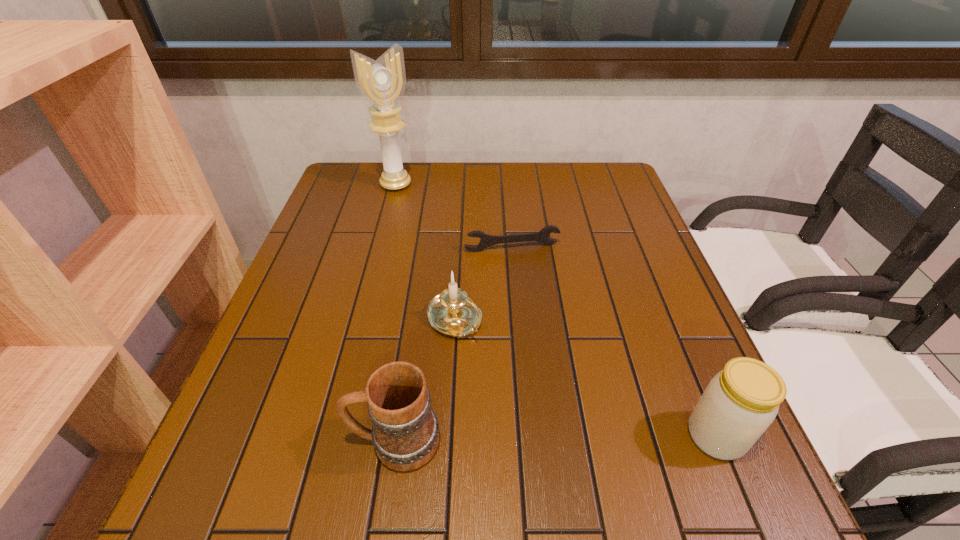
Locate an element on the screen. The height and width of the screenshot is (540, 960). free space located on the handle side of the third nearest object is located at coordinates (491, 368).

Locate an element on the screen. The width and height of the screenshot is (960, 540). object present at the far edge is located at coordinates (382, 82).

Where is `mug located at the near edge`? This screenshot has height=540, width=960. mug located at the near edge is located at coordinates (405, 434).

At what (x,y) coordinates should I click in order to perform the action: click on jar present at the near edge. Please return your answer as a coordinate pair (x, y). Image resolution: width=960 pixels, height=540 pixels. Looking at the image, I should click on (741, 401).

Where is `object that is at the left edge`? Image resolution: width=960 pixels, height=540 pixels. object that is at the left edge is located at coordinates (382, 82).

Where is `object that is at the right edge`? The image size is (960, 540). object that is at the right edge is located at coordinates (741, 401).

Locate an element on the screen. The height and width of the screenshot is (540, 960). object at the far left corner is located at coordinates (382, 82).

Locate an element on the screen. Image resolution: width=960 pixels, height=540 pixels. object located in the near right corner section of the desktop is located at coordinates (741, 401).

Locate an element on the screen. This screenshot has width=960, height=540. vacant space at the far edge of the desktop is located at coordinates (479, 183).

Find the location of a particular element. free region at the near edge is located at coordinates click(509, 423).